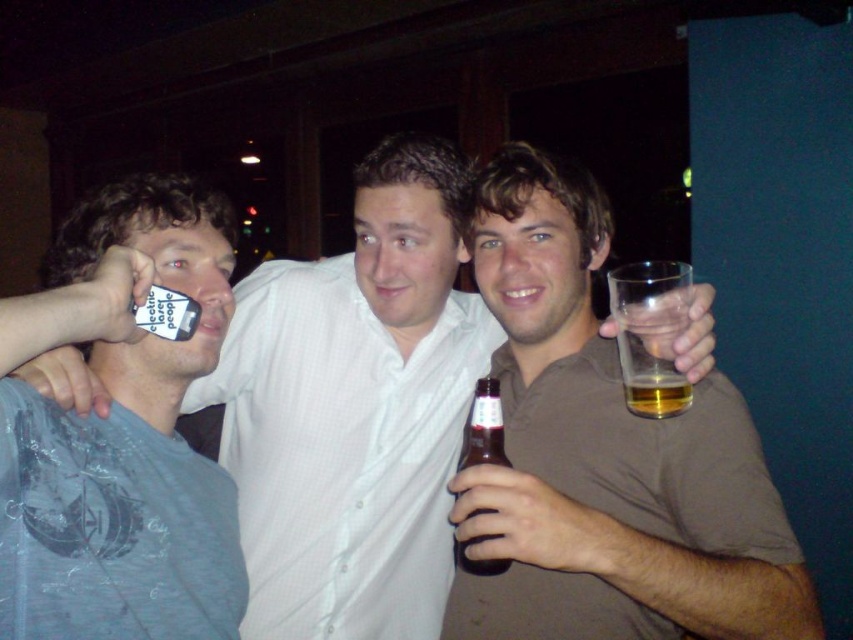
You are at a party and want to grab a drink from the table next to you. There is a matte white shirt at center and a translucent glass at right on the table. Which object is closer to you if you are facing the table?

The matte white shirt at center is closer to you because it is positioned on the left side of the translucent glass at right, meaning it is nearer when facing the table.

You are at a party and want to grab a drink from the table where the matte white shirt at center and brown glass bottle at center are located. Can you tell me which one is taller?

The matte white shirt at center is much taller than the brown glass bottle at center.